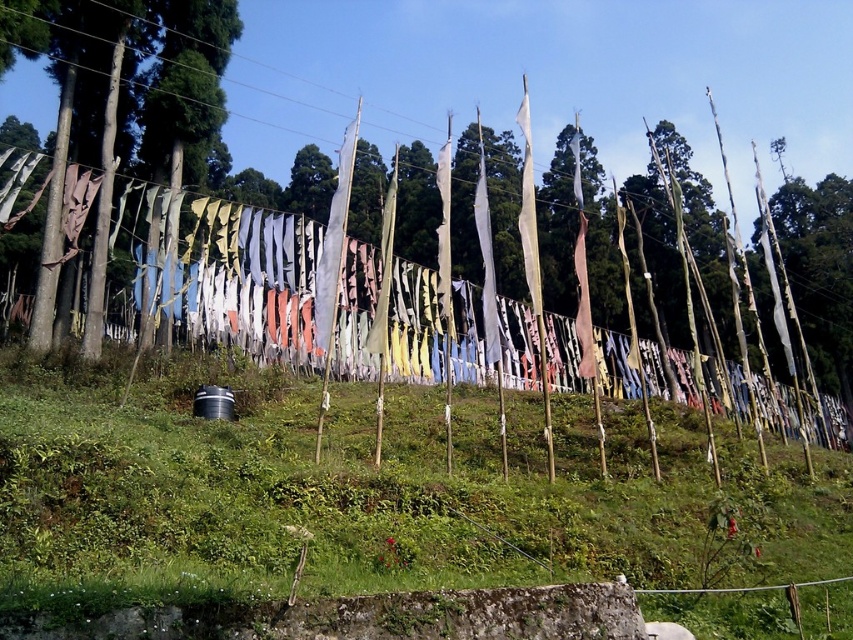
Question: Which of the following is the closest to the observer?

Choices:
 (A) green leafy tree at center
 (B) green matte tree at left

Answer: (B)

Question: Where is green grassy at center located in relation to green leafy tree at center in the image?

Choices:
 (A) left
 (B) right

Answer: (A)

Question: Does green leafy tree at center have a greater width compared to green matte tree at left?

Choices:
 (A) yes
 (B) no

Answer: (A)

Question: Which point appears closest to the camera in this image?

Choices:
 (A) (341, 0)
 (B) (219, 113)
 (C) (0, 490)

Answer: (C)

Question: Considering the real-world distances, which object is closest to the green leafy tree at center?

Choices:
 (A) green grassy at center
 (B) green matte tree at left

Answer: (B)

Question: Is green leafy tree at center smaller than green matte tree at left?

Choices:
 (A) no
 (B) yes

Answer: (A)